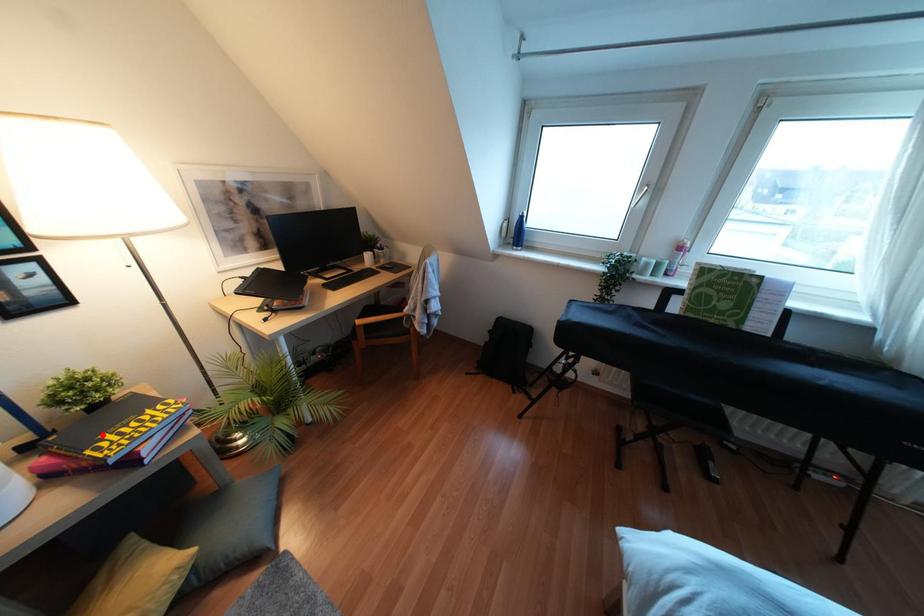
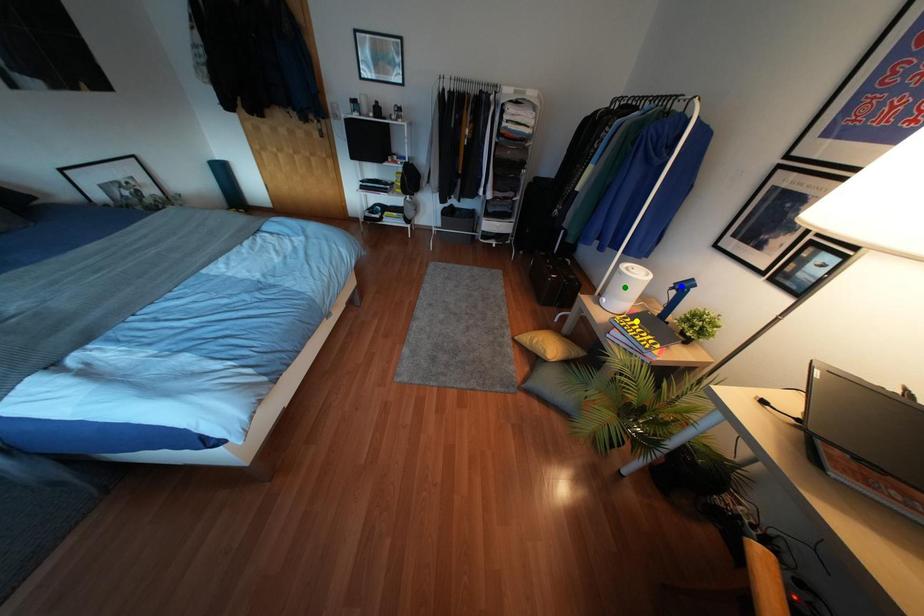
Question: I am providing you with two images of the same scene from different viewpoints. A red point is marked on the first image. You are given multiple points on the second image. Which spot in image 2 lines up with the point in image 1?

Choices:
 (A) yellow point
 (B) blue point
 (C) green point

Answer: (A)